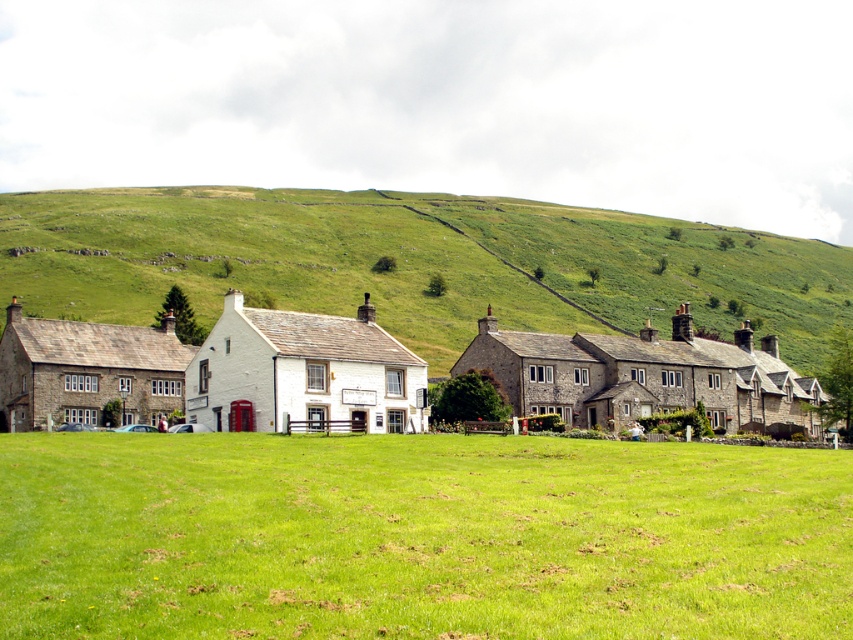
Question: Can you confirm if green grass at center is positioned above green grassy hillside at center?

Choices:
 (A) no
 (B) yes

Answer: (A)

Question: Can you confirm if green grass at center is positioned above green grassy hillside at center?

Choices:
 (A) yes
 (B) no

Answer: (B)

Question: Considering the real-world distances, which object is farthest from the stone houses at center?

Choices:
 (A) green grass at center
 (B) green grassy hillside at center

Answer: (B)

Question: Among these points, which one is farthest from the camera?

Choices:
 (A) (378, 243)
 (B) (532, 332)
 (C) (762, 566)

Answer: (A)

Question: Is green grass at center behind stone houses at center?

Choices:
 (A) no
 (B) yes

Answer: (A)

Question: Which of these objects is positioned farthest from the green grassy hillside at center?

Choices:
 (A) green grass at center
 (B) stone houses at center

Answer: (A)